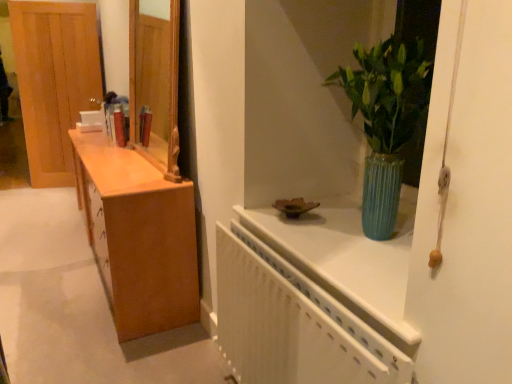
Question: Is white textured radiator at upper right in front of light brown wood door at left?

Choices:
 (A) yes
 (B) no

Answer: (A)

Question: Does white textured radiator at upper right appear on the left side of light brown wood door at left?

Choices:
 (A) yes
 (B) no

Answer: (B)

Question: Is white textured radiator at upper right bigger than light brown wood door at left?

Choices:
 (A) yes
 (B) no

Answer: (B)

Question: Is white textured radiator at upper right taller than light brown wood door at left?

Choices:
 (A) no
 (B) yes

Answer: (A)

Question: From a real-world perspective, is white textured radiator at upper right on light brown wood door at left?

Choices:
 (A) no
 (B) yes

Answer: (A)

Question: From their relative heights in the image, would you say green ribbed vase at upper right is taller or shorter than light brown wood door at left?

Choices:
 (A) tall
 (B) short

Answer: (B)

Question: Is point (407, 44) closer or farther from the camera than point (29, 114)?

Choices:
 (A) farther
 (B) closer

Answer: (B)

Question: Considering the positions of green ribbed vase at upper right and light brown wood door at left in the image, is green ribbed vase at upper right wider or thinner than light brown wood door at left?

Choices:
 (A) thin
 (B) wide

Answer: (B)

Question: From the image's perspective, is green ribbed vase at upper right located above or below light brown wood door at left?

Choices:
 (A) above
 (B) below

Answer: (B)

Question: In terms of width, does light brown wood door at left look wider or thinner when compared to green ribbed vase at upper right?

Choices:
 (A) wide
 (B) thin

Answer: (B)

Question: Considering the positions of light brown wood door at left and green ribbed vase at upper right in the image, is light brown wood door at left bigger or smaller than green ribbed vase at upper right?

Choices:
 (A) big
 (B) small

Answer: (A)

Question: From the image's perspective, is light brown wood door at left located above or below green ribbed vase at upper right?

Choices:
 (A) above
 (B) below

Answer: (A)

Question: From a real-world perspective, relative to green ribbed vase at upper right, is light brown wood door at left vertically above or below?

Choices:
 (A) below
 (B) above

Answer: (A)

Question: Based on their positions, is white textured radiator at upper right located to the left or right of light brown wood door at left?

Choices:
 (A) right
 (B) left

Answer: (A)

Question: Is white textured radiator at upper right bigger or smaller than light brown wood door at left?

Choices:
 (A) big
 (B) small

Answer: (B)